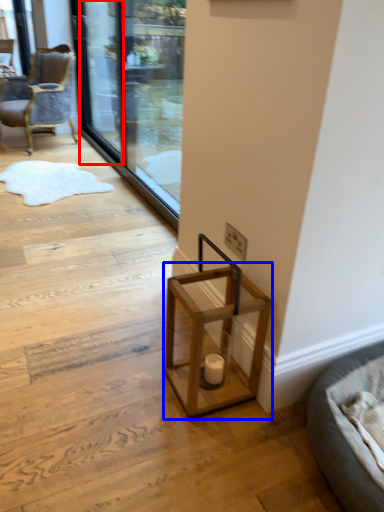
Question: Which of the following is the farthest to the observer, screen door (highlighted by a red box) or table (highlighted by a blue box)?

Choices:
 (A) screen door
 (B) table

Answer: (A)